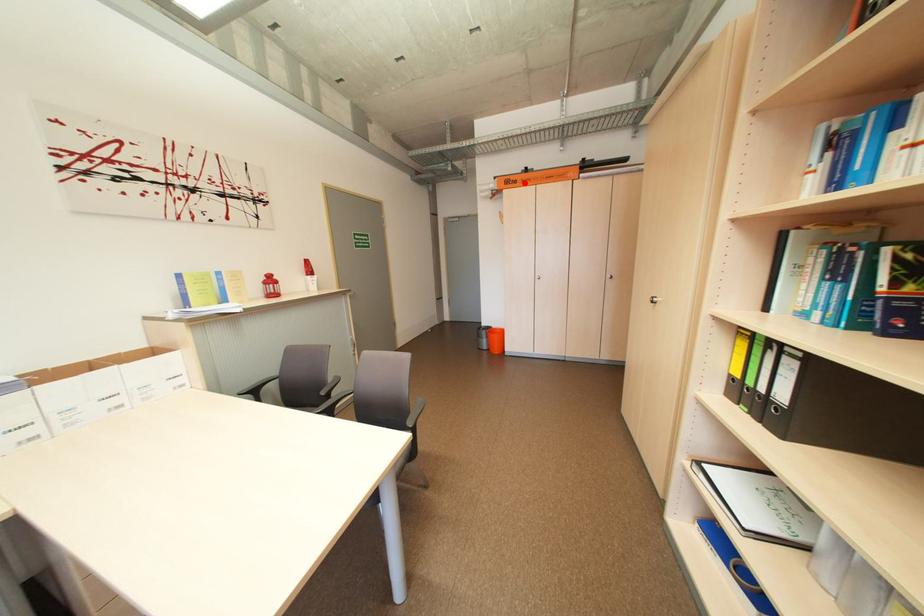
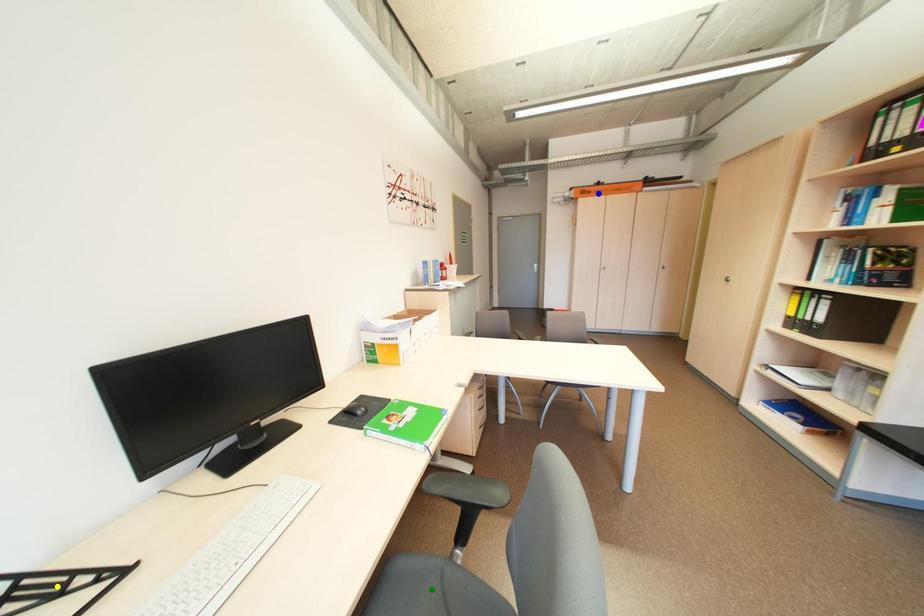
Question: I am providing you with two images of the same scene from different viewpoints. A red point is marked on the first image. You are given multiple points on the second image. Which point in image 2 represents the same 3d spot as the red point in image 1?

Choices:
 (A) green point
 (B) blue point
 (C) yellow point

Answer: (B)